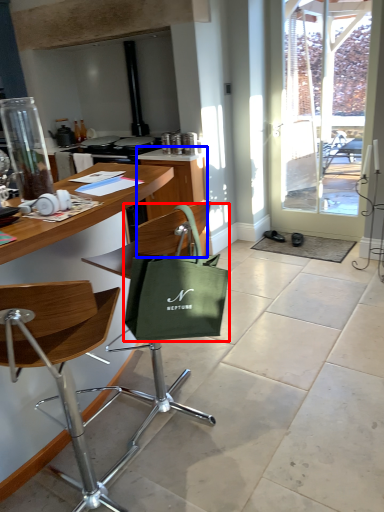
Question: Which object is closer to the camera taking this photo, handbag (highlighted by a red box) or cabinetry (highlighted by a blue box)?

Choices:
 (A) handbag
 (B) cabinetry

Answer: (A)